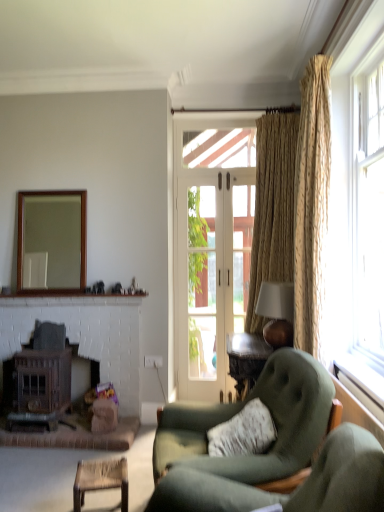
At what (x,y) coordinates should I click in order to perform the action: click on gold textured curtain at right, arranged as the first curtain when viewed from the front. Please return your answer as a coordinate pair (x, y). Looking at the image, I should click on 312,206.

What is the approximate width of translucent glass window at right?

translucent glass window at right is 11.11 inches in width.

The height and width of the screenshot is (512, 384). Describe the element at coordinates (43, 378) in the screenshot. I see `wooden stove at lower left` at that location.

The image size is (384, 512). Describe the element at coordinates (202, 282) in the screenshot. I see `clear glass door at center` at that location.

Image resolution: width=384 pixels, height=512 pixels. What are the coordinates of `clear glass door at center` in the screenshot? It's located at (202, 282).

Image resolution: width=384 pixels, height=512 pixels. Identify the location of rattan chair at lower left. (100, 480).

Would you say clear glass door at center is part of dark brown wood fireplace at lower left's contents?

No.

Is dark brown wood fireplace at lower left oriented towards clear glass door at center?

No, dark brown wood fireplace at lower left is not oriented towards clear glass door at center.

Is point (131, 361) farther from camera compared to point (209, 202)?

No, (131, 361) is closer to viewer.

Looking at this image, which of these two, matte brown lampshade at upper right or textured beige curtain at right, which is the second curtain from front to back, stands shorter?

With less height is matte brown lampshade at upper right.

Is matte brown lampshade at upper right to the left of textured beige curtain at right, which appears as the first curtain when viewed from the back, from the viewer's perspective?

Indeed, matte brown lampshade at upper right is positioned on the left side of textured beige curtain at right, which appears as the first curtain when viewed from the back.

Can you tell me how much matte brown lampshade at upper right and textured beige curtain at right, which is the second curtain from front to back, differ in facing direction?

The angle between the facing direction of matte brown lampshade at upper right and the facing direction of textured beige curtain at right, which is the second curtain from front to back, is 91.9 degrees.

Would you say matte brown lampshade at upper right is outside textured beige curtain at right, which appears as the first curtain when viewed from the back?

matte brown lampshade at upper right lies outside textured beige curtain at right, which appears as the first curtain when viewed from the back,'s area.

Would you say wooden frame mirror at upper left is inside or outside rattan chair at lower left?

wooden frame mirror at upper left cannot be found inside rattan chair at lower left.

Which of these two, wooden frame mirror at upper left or rattan chair at lower left, stands shorter?

Standing shorter between the two is rattan chair at lower left.

In the image, is wooden frame mirror at upper left positioned in front of or behind rattan chair at lower left?

Clearly, wooden frame mirror at upper left is behind rattan chair at lower left.

I want to click on table below the wooden frame mirror at upper left (from the image's perspective), so click(x=100, y=480).

Can you confirm if textured beige curtain at right, which is the second curtain from front to back, is thinner than rattan chair at lower left?

No.

Where is `table that is in front of the textured beige curtain at right, which is the second curtain from front to back`? table that is in front of the textured beige curtain at right, which is the second curtain from front to back is located at coordinates [x=100, y=480].

Considering the points (291, 115) and (110, 479), which point is in front, point (291, 115) or point (110, 479)?

Point (110, 479)

From a real-world perspective, relative to rattan chair at lower left, is textured beige curtain at right, which appears as the first curtain when viewed from the back, vertically above or below?

Clearly, from a real-world perspective, textured beige curtain at right, which appears as the first curtain when viewed from the back, is above rattan chair at lower left.

Where is `mirror that is above the rattan chair at lower left (from the image's perspective)`? The image size is (384, 512). mirror that is above the rattan chair at lower left (from the image's perspective) is located at coordinates (55, 236).

From a real-world perspective, is rattan chair at lower left positioned over wooden frame mirror at upper left based on gravity?

No, from a real-world perspective, rattan chair at lower left is not over wooden frame mirror at upper left

Is rattan chair at lower left oriented away from wooden frame mirror at upper left?

No.

Considering the positions of points (191, 300) and (70, 286), is point (191, 300) closer to camera compared to point (70, 286)?

That is True.

Considering the relative positions of clear glass door at center and wooden frame mirror at upper left in the image provided, is clear glass door at center to the right of wooden frame mirror at upper left from the viewer's perspective?

Yes, clear glass door at center is to the right of wooden frame mirror at upper left.

From the image's perspective, is clear glass door at center under wooden frame mirror at upper left?

Yes, from the image's perspective, clear glass door at center is beneath wooden frame mirror at upper left.

From a real-world perspective, which object stands above the other?

From a 3D spatial view, wooden frame mirror at upper left is above.

Can you tell me how much wooden frame mirror at upper left and suede green armchair at lower right differ in facing direction?

The angular difference between wooden frame mirror at upper left and suede green armchair at lower right is 79.7 degrees.

From a real-world perspective, who is located higher, wooden frame mirror at upper left or suede green armchair at lower right?

wooden frame mirror at upper left, from a real-world perspective.

Consider the image. Considering the relative sizes of wooden frame mirror at upper left and suede green armchair at lower right in the image provided, is wooden frame mirror at upper left taller than suede green armchair at lower right?

Yes, wooden frame mirror at upper left is taller than suede green armchair at lower right.

From the image's perspective, relative to suede green armchair at lower right, is wooden frame mirror at upper left above or below?

wooden frame mirror at upper left is above suede green armchair at lower right.

I want to click on window screen above the dark brown wood fireplace at lower left (from the image's perspective), so click(202, 282).

Where is `table lamp lying in front of the textured beige curtain at right, which appears as the first curtain when viewed from the back`? This screenshot has width=384, height=512. table lamp lying in front of the textured beige curtain at right, which appears as the first curtain when viewed from the back is located at coordinates (277, 313).

Looking at the image, which one is located further to clear glass door at center, dark brown wood fireplace at lower left or gold textured curtain at right, arranged as the first curtain when viewed from the front?

gold textured curtain at right, arranged as the first curtain when viewed from the front, lies further to clear glass door at center than the other object.

Looking at the image, which one is located further to translucent glass window at right, rattan chair at lower left or matte brown lampshade at upper right?

The object further to translucent glass window at right is rattan chair at lower left.

Looking at the image, which one is located closer to dark brown wood fireplace at lower left, suede green armchair at lower right or gold textured curtain at right, arranged as the first curtain when viewed from the front?

suede green armchair at lower right lies closer to dark brown wood fireplace at lower left than the other object.

Considering their positions, is suede green armchair at lower right positioned closer to wooden frame mirror at upper left than textured beige curtain at right, which appears as the first curtain when viewed from the back?

The object closer to wooden frame mirror at upper left is textured beige curtain at right, which appears as the first curtain when viewed from the back.

Which object lies nearer to the anchor point textured beige curtain at right, which appears as the first curtain when viewed from the back, wooden stove at lower left or wooden frame mirror at upper left?

wooden stove at lower left is closer to textured beige curtain at right, which appears as the first curtain when viewed from the back.

Estimate the real-world distances between objects in this image. Which object is closer to matte brown lampshade at upper right, translucent glass window at right or clear glass door at center?

translucent glass window at right is closer to matte brown lampshade at upper right.

When comparing their distances from translucent glass window at right, does clear glass door at center or suede green armchair at lower right seem further?

Among the two, clear glass door at center is located further to translucent glass window at right.

Which object lies further to the anchor point translucent glass window at right, dark brown wood fireplace at lower left or matte brown lampshade at upper right?

dark brown wood fireplace at lower left lies further to translucent glass window at right than the other object.

Identify the location of table lamp between rattan chair at lower left and clear glass door at center from front to back. This screenshot has width=384, height=512. (277, 313).

Locate an element on the screen. curtain located between gold textured curtain at right, arranged as the first curtain when viewed from the front, and clear glass door at center in the depth direction is located at coordinates (272, 208).

This screenshot has height=512, width=384. Find the location of `stove between translucent glass window at right and clear glass door at center along the z-axis`. stove between translucent glass window at right and clear glass door at center along the z-axis is located at coordinates (43, 378).

Image resolution: width=384 pixels, height=512 pixels. Find the location of `fireplace between wooden frame mirror at upper left and wooden stove at lower left in the up-down direction`. fireplace between wooden frame mirror at upper left and wooden stove at lower left in the up-down direction is located at coordinates (83, 357).